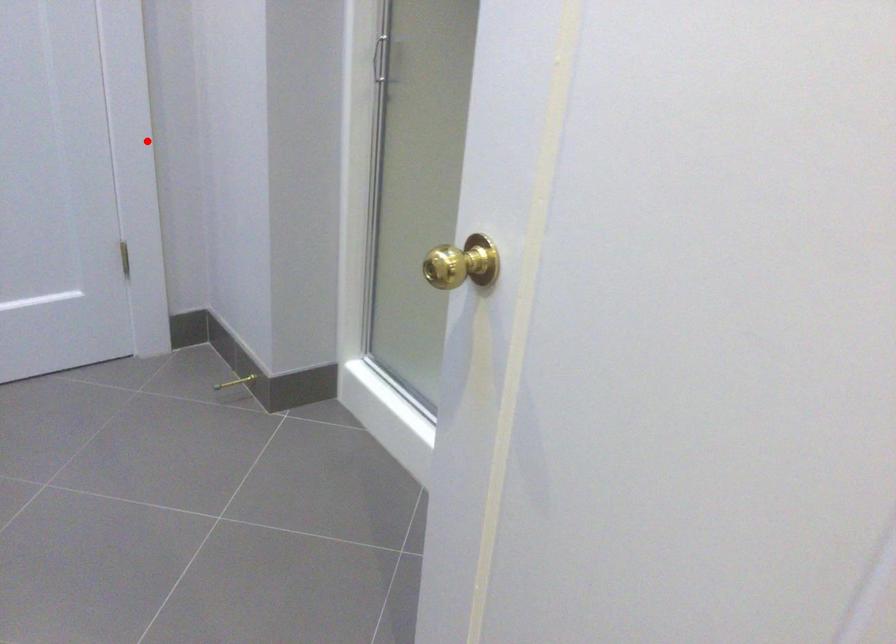
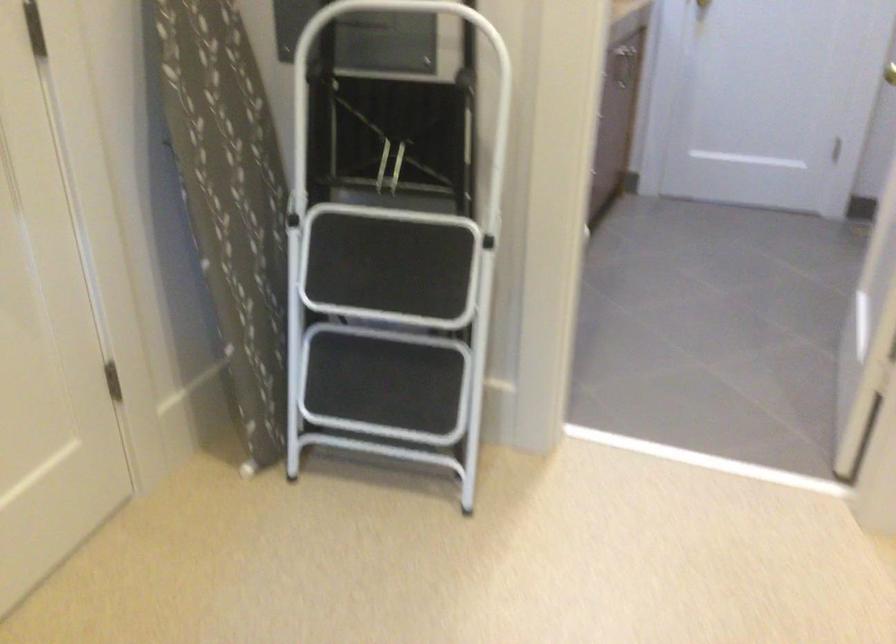
Question: I am providing you with two images of the same scene from different viewpoints. Image1 has a red point marked. In image2, the corresponding 3D location appears at what relative position? Reply with the corresponding letter.

Choices:
 (A) Closer
 (B) Farther

Answer: (B)